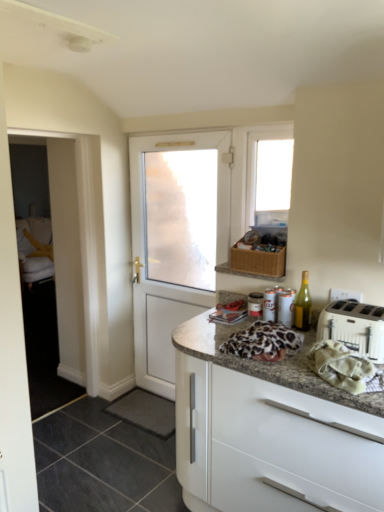
Question: Would you say white cloth at right is part of green glass bottle at right's contents?

Choices:
 (A) yes
 (B) no

Answer: (B)

Question: Is green glass bottle at right outside white cloth at right?

Choices:
 (A) yes
 (B) no

Answer: (A)

Question: Considering the relative sizes of green glass bottle at right and white cloth at right in the image provided, is green glass bottle at right smaller than white cloth at right?

Choices:
 (A) no
 (B) yes

Answer: (B)

Question: From the image's perspective, does green glass bottle at right appear higher than white cloth at right?

Choices:
 (A) yes
 (B) no

Answer: (A)

Question: Is green glass bottle at right at the right side of white cloth at right?

Choices:
 (A) yes
 (B) no

Answer: (B)

Question: From the image's perspective, is white cloth at right located above or below white glossy cabinet at lower right?

Choices:
 (A) above
 (B) below

Answer: (A)

Question: Does point (350, 373) appear closer or farther from the camera than point (274, 454)?

Choices:
 (A) closer
 (B) farther

Answer: (A)

Question: Is white cloth at right wider or thinner than white glossy cabinet at lower right?

Choices:
 (A) thin
 (B) wide

Answer: (A)

Question: Is white cloth at right in front of or behind white glossy cabinet at lower right in the image?

Choices:
 (A) front
 (B) behind

Answer: (B)

Question: From a real-world perspective, is black rubber mat at lower center, which is the 1th tile from back to front, physically located above or below metallic silver canister at upper right?

Choices:
 (A) below
 (B) above

Answer: (A)

Question: In the image, is black rubber mat at lower center, the second tile in the front-to-back sequence, on the left side or the right side of metallic silver canister at upper right?

Choices:
 (A) left
 (B) right

Answer: (A)

Question: Relative to metallic silver canister at upper right, is black rubber mat at lower center, the second tile in the front-to-back sequence, in front or behind?

Choices:
 (A) behind
 (B) front

Answer: (A)

Question: Considering the positions of black rubber mat at lower center, the second tile in the front-to-back sequence, and metallic silver canister at upper right in the image, is black rubber mat at lower center, the second tile in the front-to-back sequence, taller or shorter than metallic silver canister at upper right?

Choices:
 (A) tall
 (B) short

Answer: (B)

Question: Considering the positions of transparent glass window at upper center and black rubber mat at lower center, the second tile in the front-to-back sequence, in the image, is transparent glass window at upper center taller or shorter than black rubber mat at lower center, the second tile in the front-to-back sequence,?

Choices:
 (A) short
 (B) tall

Answer: (B)

Question: Looking at the image, does transparent glass window at upper center seem bigger or smaller compared to black rubber mat at lower center, the second tile in the front-to-back sequence?

Choices:
 (A) big
 (B) small

Answer: (A)